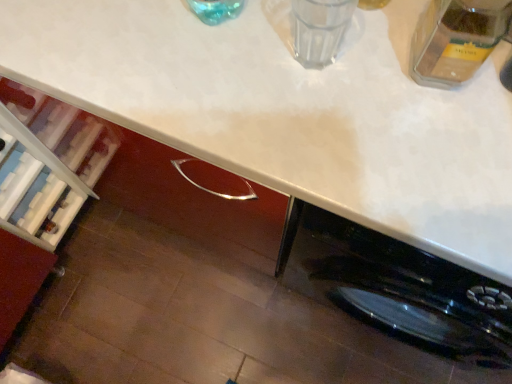
Describe the element at coordinates (291, 112) in the screenshot. I see `white glossy countertop at upper center` at that location.

At what (x,y) coordinates should I click in order to perform the action: click on transparent glass at upper center. Please return your answer as a coordinate pair (x, y). The height and width of the screenshot is (384, 512). Looking at the image, I should click on (319, 29).

Find the location of a particular element. The width and height of the screenshot is (512, 384). transparent glass jar at upper right is located at coordinates (456, 39).

Consider the image. Does white glossy countertop at upper center come behind transparent glass at upper center?

That is False.

Looking at the image, does white glossy countertop at upper center seem bigger or smaller compared to transparent glass at upper center?

In the image, white glossy countertop at upper center appears to be larger than transparent glass at upper center.

Is transparent glass at upper center at the back of white glossy countertop at upper center?

No, transparent glass at upper center is not at the back of white glossy countertop at upper center.

In the image, there is a transparent glass at upper center. At what (x,y) coordinates should I click in order to perform the action: click on countertop below it (from a real-world perspective). Please return your answer as a coordinate pair (x, y). Image resolution: width=512 pixels, height=384 pixels. Looking at the image, I should click on (291, 112).

Does transparent glass at upper center have a greater width compared to transparent glass jar at upper right?

In fact, transparent glass at upper center might be narrower than transparent glass jar at upper right.

Looking at this image, from the image's perspective, which object appears higher, transparent glass at upper center or transparent glass jar at upper right?

From the image's view, transparent glass at upper center is above.

Between transparent glass at upper center and transparent glass jar at upper right, which one appears on the left side from the viewer's perspective?

transparent glass at upper center.

Can you confirm if transparent glass at upper center is shorter than transparent glass jar at upper right?

Yes, transparent glass at upper center is shorter than transparent glass jar at upper right.

Between transparent glass jar at upper right and transparent glass at upper center, which one is positioned in front?

transparent glass jar at upper right is in front.

Can you confirm if transparent glass jar at upper right is thinner than transparent glass at upper center?

No, transparent glass jar at upper right is not thinner than transparent glass at upper center.

The height and width of the screenshot is (384, 512). I want to click on glass jar that is on the right side of transparent glass at upper center, so click(456, 39).

Between transparent glass jar at upper right and transparent glass at upper center, which one has larger size?

transparent glass jar at upper right.

Which is nearer, (502,7) or (86,98)?

Point (502,7) is closer to the camera than point (86,98).

Who is smaller, transparent glass jar at upper right or white glossy countertop at upper center?

Smaller between the two is transparent glass jar at upper right.

Where is `countertop directly beneath the transparent glass jar at upper right (from a real-world perspective)`? The height and width of the screenshot is (384, 512). countertop directly beneath the transparent glass jar at upper right (from a real-world perspective) is located at coordinates (291, 112).

From the image's perspective, is transparent glass jar at upper right on top of white glossy countertop at upper center?

Yes, from the image's perspective, transparent glass jar at upper right is over white glossy countertop at upper center.

Is transparent glass at upper center to the left of white glossy countertop at upper center from the viewer's perspective?

No, transparent glass at upper center is not to the left of white glossy countertop at upper center.

From the image's perspective, which is below, transparent glass at upper center or white glossy countertop at upper center?

white glossy countertop at upper center is shown below in the image.

Is transparent glass at upper center in front of or behind white glossy countertop at upper center in the image?

In the image, transparent glass at upper center appears behind white glossy countertop at upper center.

From the image's perspective, is white glossy countertop at upper center below transparent glass jar at upper right?

Indeed, from the image's perspective, white glossy countertop at upper center is shown beneath transparent glass jar at upper right.

Would you say white glossy countertop at upper center is outside transparent glass jar at upper right?

white glossy countertop at upper center lies outside transparent glass jar at upper right's area.

Locate an element on the screen. glass jar that appears behind the white glossy countertop at upper center is located at coordinates (456, 39).

Can you confirm if white glossy countertop at upper center is shorter than transparent glass jar at upper right?

No, white glossy countertop at upper center is not shorter than transparent glass jar at upper right.

Where is `water above the white glossy countertop at upper center (from the image's perspective)`? The image size is (512, 384). water above the white glossy countertop at upper center (from the image's perspective) is located at coordinates (319, 29).

The height and width of the screenshot is (384, 512). Find the location of `water behind the transparent glass jar at upper right`. water behind the transparent glass jar at upper right is located at coordinates (319, 29).

Estimate the real-world distances between objects in this image. Which object is further from transparent glass jar at upper right, transparent glass at upper center or white glossy countertop at upper center?

white glossy countertop at upper center.

Looking at the image, which one is located closer to white glossy countertop at upper center, transparent glass at upper center or transparent glass jar at upper right?

Among the two, transparent glass at upper center is located nearer to white glossy countertop at upper center.

When comparing their distances from transparent glass jar at upper right, does white glossy countertop at upper center or transparent glass at upper center seem closer?

transparent glass at upper center.

Which object lies nearer to the anchor point transparent glass at upper center, white glossy countertop at upper center or transparent glass jar at upper right?

transparent glass jar at upper right lies closer to transparent glass at upper center than the other object.

Estimate the real-world distances between objects in this image. Which object is closer to white glossy countertop at upper center, transparent glass jar at upper right or transparent glass at upper center?

transparent glass at upper center lies closer to white glossy countertop at upper center than the other object.

Considering their positions, is transparent glass jar at upper right positioned further to transparent glass at upper center than white glossy countertop at upper center?

white glossy countertop at upper center is positioned further to the anchor transparent glass at upper center.

This screenshot has height=384, width=512. I want to click on water between white glossy countertop at upper center and transparent glass jar at upper right, so click(x=319, y=29).